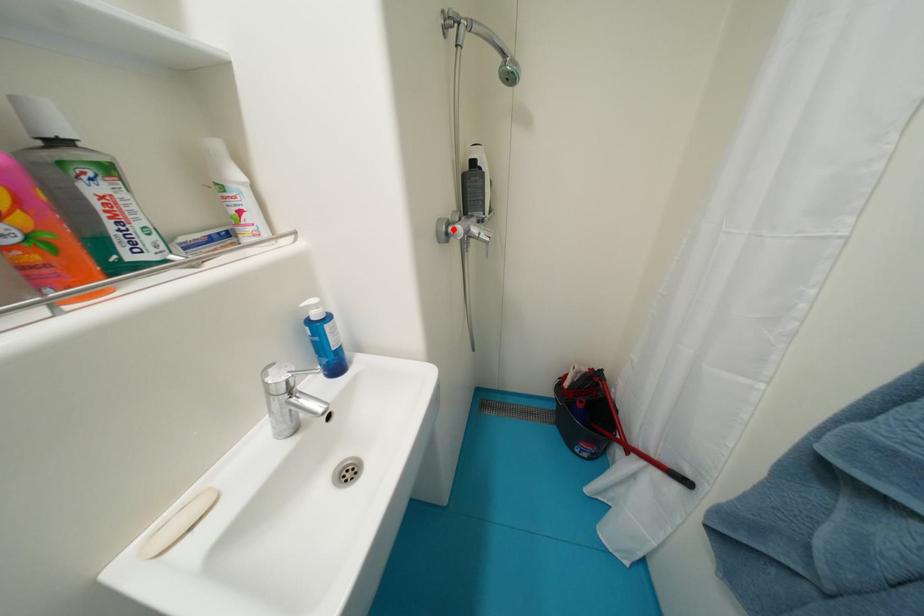
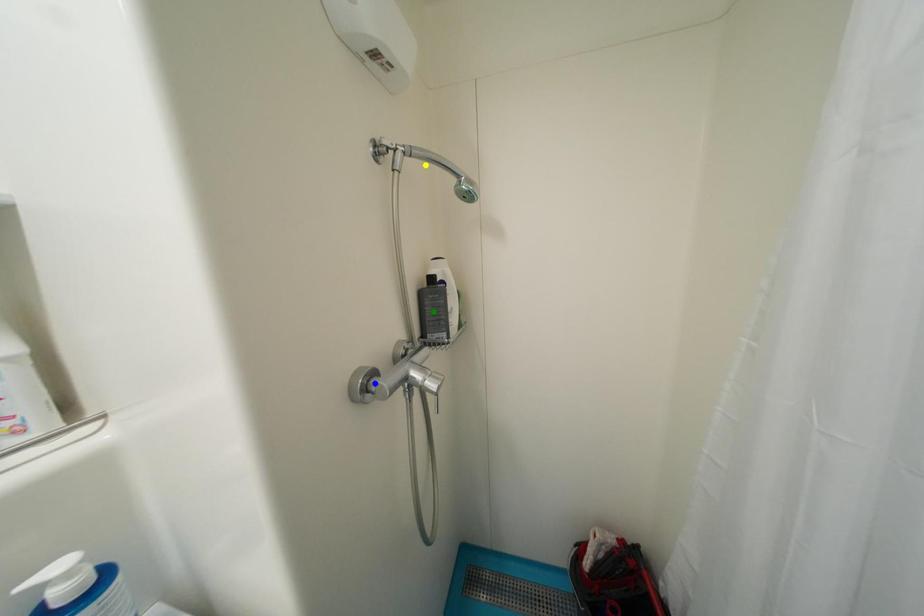
Question: I am providing you with two images of the same scene from different viewpoints. A red point is marked on the first image. You are given multiple points on the second image. Can you choose the point in image 2 that corresponds to the point in image 1?

Choices:
 (A) yellow point
 (B) blue point
 (C) green point

Answer: (B)